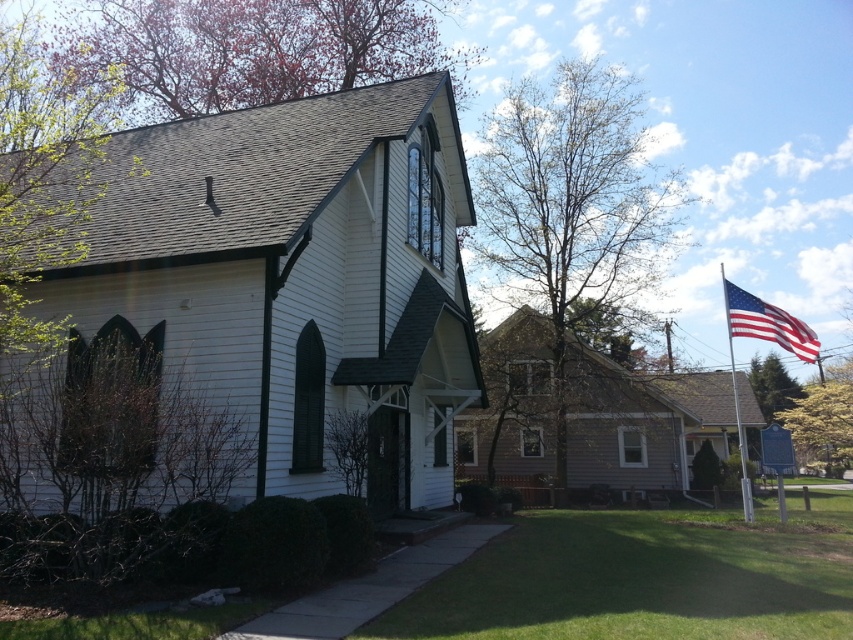
You are a photographer wanting to capture both the white wood chapel at center and the silver metallic flag pole at right in a single shot. Based on their positions, which one should you focus on first to ensure both are in frame?

Since the white wood chapel at center is located above the silver metallic flag pole at right, you should focus on the white wood chapel at center first to ensure both are in frame.

You are standing in the middle of the suburban scene and want to walk towards the silver metallic flag pole at right. Which direction should you move relative to the white wood chapel at center?

Since the white wood chapel at center is to the left of the silver metallic flag pole at right, you should move to the right of the white wood chapel at center to reach the silver metallic flag pole at right.

You are a photographer planning to capture the white wood chapel at center and the silver metallic flag pole at right in a single frame. Based on their heights, which object will appear taller in the photo?

The silver metallic flag pole at right is taller than the white wood chapel at center, so it will appear taller in the photo.